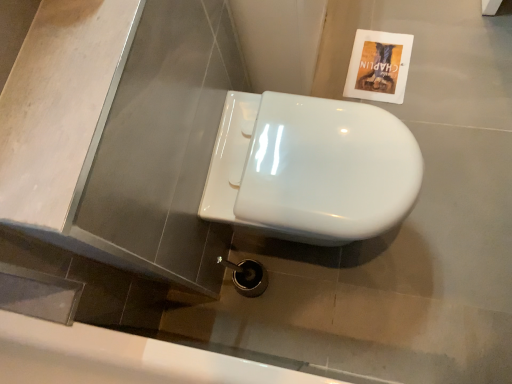
The height and width of the screenshot is (384, 512). Find the location of `empty space that is to the right of white glossy toilet at center`. empty space that is to the right of white glossy toilet at center is located at coordinates pyautogui.click(x=448, y=173).